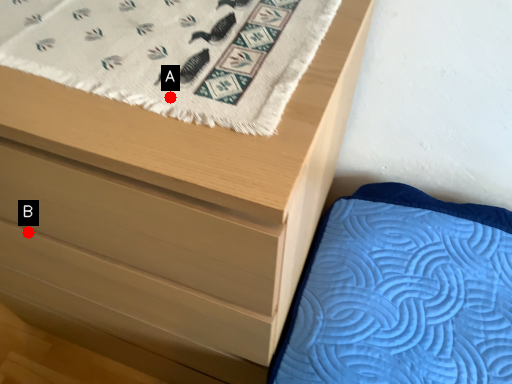
Question: Two points are circled on the image, labeled by A and B beside each circle. Which of the following is the farthest from the observer?

Choices:
 (A) A is further
 (B) B is further

Answer: (B)